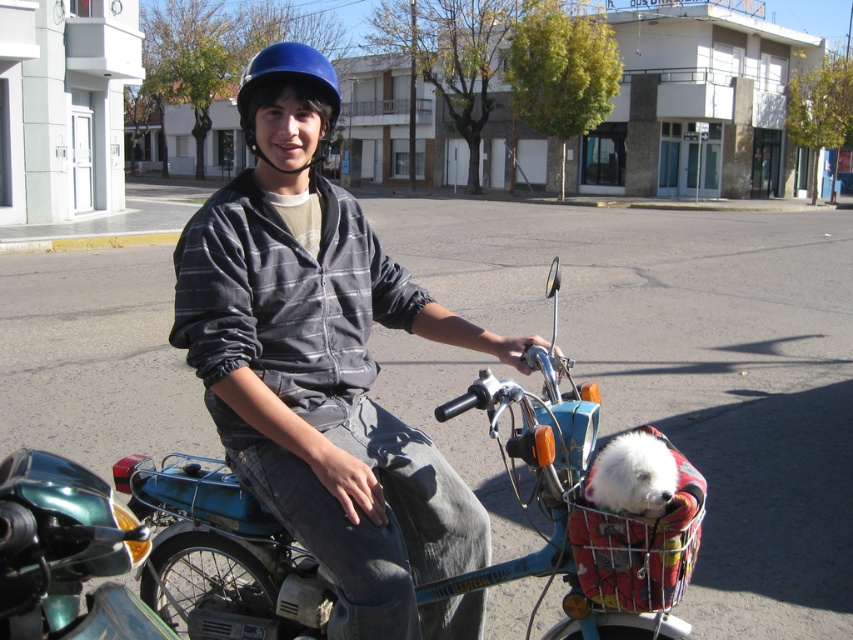
Is point (436, 474) more distant than point (256, 83)?

Yes.

Can you confirm if matte blue helmet at center is smaller than blue matte helmet at center?

Indeed, matte blue helmet at center has a smaller size compared to blue matte helmet at center.

Identify the location of matte blue helmet at center. This screenshot has height=640, width=853. click(323, 365).

Locate an element on the screen. Image resolution: width=853 pixels, height=640 pixels. matte blue helmet at center is located at coordinates (323, 365).

Which is above, matte blue helmet at center or blue metallic motorcycle at center?

matte blue helmet at center

Find the location of a particular element. matte blue helmet at center is located at coordinates (323, 365).

Which is more to the left, blue metallic motorcycle at center or blue matte helmet at center?

From the viewer's perspective, blue metallic motorcycle at center appears more on the left side.

Is blue metallic motorcycle at center below blue matte helmet at center?

Indeed, blue metallic motorcycle at center is positioned under blue matte helmet at center.

Who is more forward, (x=219, y=461) or (x=253, y=150)?

Point (x=253, y=150) is more forward.

Locate an element on the screen. This screenshot has height=640, width=853. blue metallic motorcycle at center is located at coordinates (582, 513).